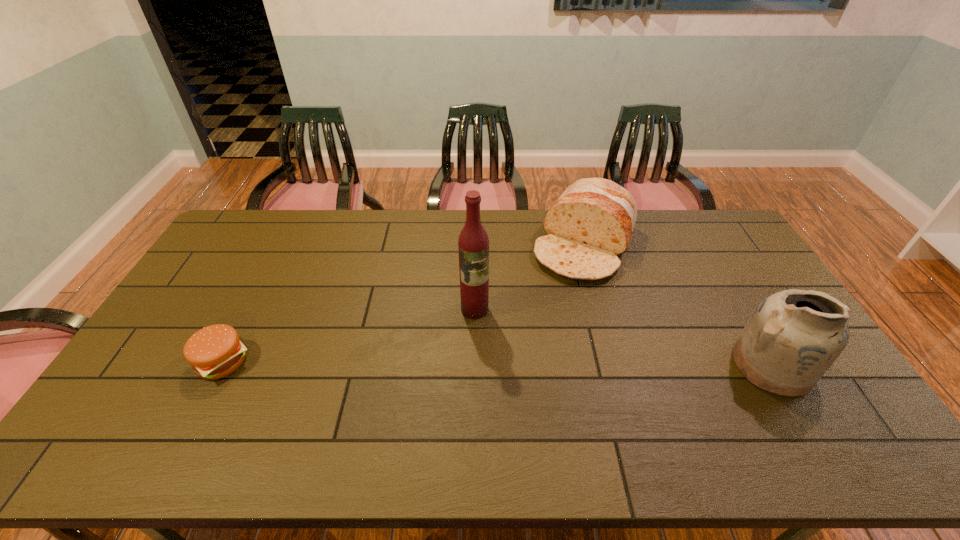
At what (x,y) coordinates should I click in order to perform the action: click on vacant area that satisfies the following two spatial constraints: 1. on the front side of the second farthest object; 2. on the left side of the rightmost object. Please return your answer as a coordinate pair (x, y). Image resolution: width=960 pixels, height=540 pixels. Looking at the image, I should click on 474,365.

The width and height of the screenshot is (960, 540). In order to click on free spot that satisfies the following two spatial constraints: 1. on the back side of the shortest object; 2. on the left side of the third tallest object in this screenshot , I will do (x=283, y=245).